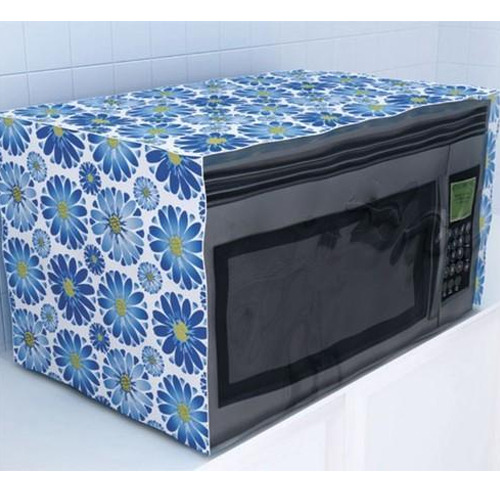
At what (x,y) coordinates should I click in order to perform the action: click on screen. Please return your answer as a coordinate pair (x, y). The width and height of the screenshot is (500, 500). Looking at the image, I should click on (463, 202).